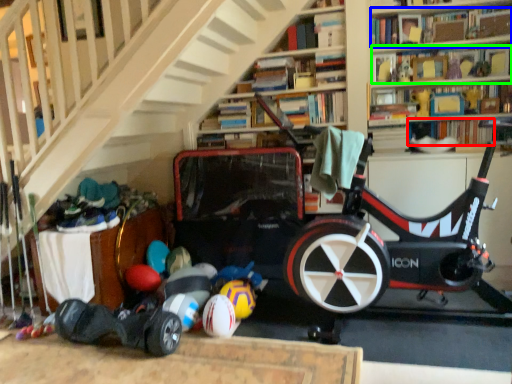
Question: Which object is the farthest from book (highlighted by a red box)? Choose among these: book (highlighted by a blue box) or book (highlighted by a green box).

Choices:
 (A) book
 (B) book

Answer: (A)